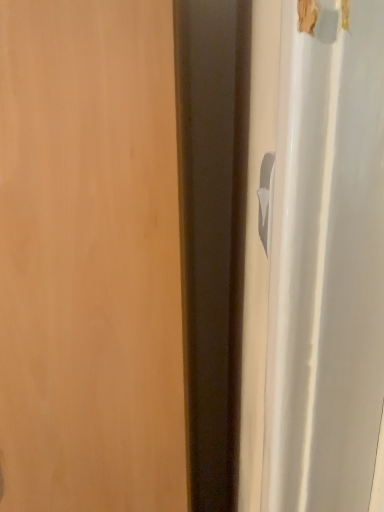
Measure the distance between point (112, 322) and camera.

Point (112, 322) is 63.70 centimeters from camera.

What is the approximate width of light wood door at left?

It is 22.03 inches.

What is the approximate height of light wood door at left?

light wood door at left is 1.49 meters in height.

Where is `light wood door at left`? Image resolution: width=384 pixels, height=512 pixels. light wood door at left is located at coordinates (89, 259).

Describe the element at coordinates (89, 259) in the screenshot. The height and width of the screenshot is (512, 384). I see `light wood door at left` at that location.

Locate an element on the screen. light wood door at left is located at coordinates (89, 259).